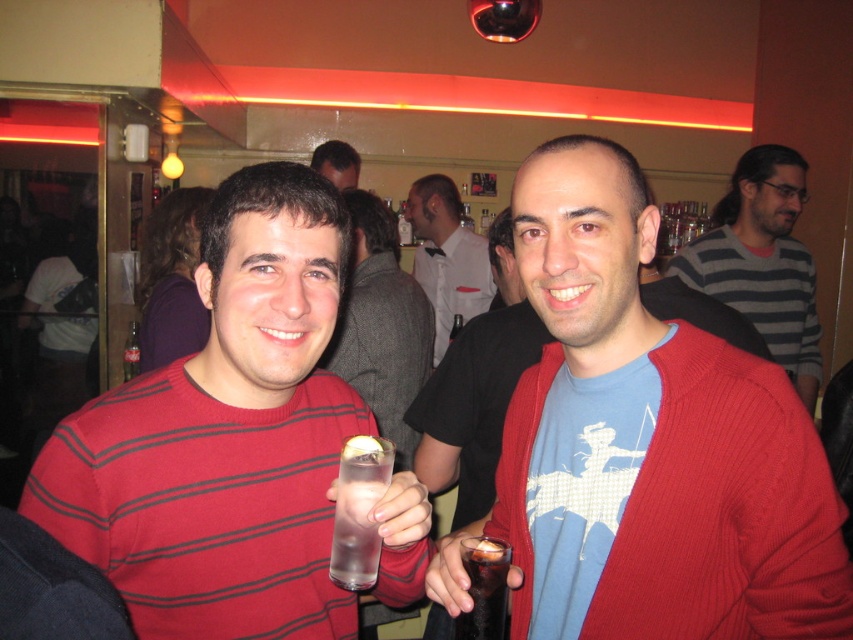
Question: Can you confirm if matte black sweater at center is positioned to the left of dark carbonated liquid at lower right?

Choices:
 (A) no
 (B) yes

Answer: (B)

Question: Is gray striped sweater at upper right further to the viewer compared to matte black sweater at center?

Choices:
 (A) yes
 (B) no

Answer: (A)

Question: Which object is closer to the camera taking this photo?

Choices:
 (A) white shirt at center
 (B) dark carbonated liquid at lower right

Answer: (B)

Question: Which object is the farthest from the dark carbonated liquid at lower right?

Choices:
 (A) striped sweater at center
 (B) clear glass water at center
 (C) red knit cardigan at center
 (D) matte black shirt at center

Answer: (D)

Question: Does dark carbonated liquid at lower right have a greater width compared to dark brown hair at upper center?

Choices:
 (A) no
 (B) yes

Answer: (A)

Question: Estimate the real-world distances between objects in this image. Which object is closer to the matte black shirt at center?

Choices:
 (A) matte black sweater at center
 (B) dark brown hair at upper center
 (C) dark carbonated liquid at lower right

Answer: (A)